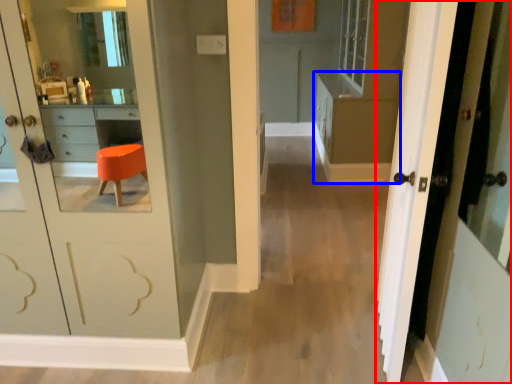
Question: Which object appears closest to the camera in this image, door (highlighted by a red box) or dresser (highlighted by a blue box)?

Choices:
 (A) door
 (B) dresser

Answer: (A)